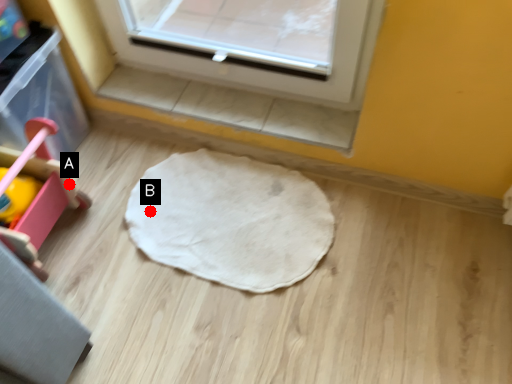
Question: Two points are circled on the image, labeled by A and B beside each circle. Which point appears farthest from the camera in this image?

Choices:
 (A) A is further
 (B) B is further

Answer: (B)